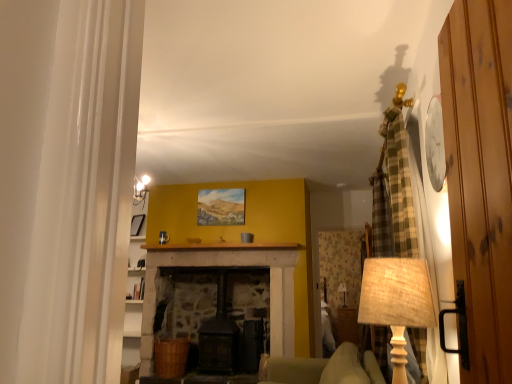
Question: Is burlap lampshade at right, acting as the first table lamp starting from the left, placed right next to matte black picture frame at left?

Choices:
 (A) no
 (B) yes

Answer: (A)

Question: Can you confirm if burlap lampshade at right, acting as the first table lamp starting from the left, is shorter than matte black picture frame at left?

Choices:
 (A) yes
 (B) no

Answer: (B)

Question: Is burlap lampshade at right, which appears as the first table lamp when viewed from the front, oriented towards matte black picture frame at left?

Choices:
 (A) yes
 (B) no

Answer: (B)

Question: Is burlap lampshade at right, the 2th table lamp when ordered from bottom to top, turned away from matte black picture frame at left?

Choices:
 (A) no
 (B) yes

Answer: (A)

Question: From the image's perspective, is burlap lampshade at right, which appears as the first table lamp when viewed from the front, over matte black picture frame at left?

Choices:
 (A) yes
 (B) no

Answer: (B)

Question: Considering their positions, is matte black picture frame at left located in front of or behind matte beige lampshade at center, the first table lamp from the right?

Choices:
 (A) behind
 (B) front

Answer: (B)

Question: Is matte black picture frame at left to the left or to the right of matte beige lampshade at center, which is the 2th table lamp in left-to-right order, in the image?

Choices:
 (A) right
 (B) left

Answer: (B)

Question: Considering the positions of matte black picture frame at left and matte beige lampshade at center, which is the 2th table lamp in left-to-right order, in the image, is matte black picture frame at left wider or thinner than matte beige lampshade at center, which is the 2th table lamp in left-to-right order,?

Choices:
 (A) thin
 (B) wide

Answer: (A)

Question: In terms of size, does matte black picture frame at left appear bigger or smaller than matte beige lampshade at center, the first table lamp when ordered from back to front?

Choices:
 (A) big
 (B) small

Answer: (B)

Question: Considering the positions of matte beige lampshade at center, which is counted as the second table lamp, starting from the front, and burlap lampshade at right, marked as the first table lamp in a top-to-bottom arrangement, in the image, is matte beige lampshade at center, which is counted as the second table lamp, starting from the front, wider or thinner than burlap lampshade at right, marked as the first table lamp in a top-to-bottom arrangement,?

Choices:
 (A) wide
 (B) thin

Answer: (B)

Question: From the image's perspective, relative to burlap lampshade at right, acting as the first table lamp starting from the left, is matte beige lampshade at center, the 1th table lamp positioned from the bottom, above or below?

Choices:
 (A) below
 (B) above

Answer: (A)

Question: Relative to burlap lampshade at right, acting as the first table lamp starting from the left, is matte beige lampshade at center, positioned as the 2th table lamp in top-to-bottom order, in front or behind?

Choices:
 (A) front
 (B) behind

Answer: (B)

Question: Would you say matte beige lampshade at center, which is the 2th table lamp in left-to-right order, is inside or outside burlap lampshade at right, which ranks as the second table lamp in right-to-left order?

Choices:
 (A) inside
 (B) outside

Answer: (B)

Question: In the image, is matte beige lampshade at center, which is counted as the second table lamp, starting from the front, on the left side or the right side of wooden door at right?

Choices:
 (A) right
 (B) left

Answer: (A)

Question: In the image, is matte beige lampshade at center, the first table lamp when ordered from back to front, positioned in front of or behind wooden door at right?

Choices:
 (A) behind
 (B) front

Answer: (A)